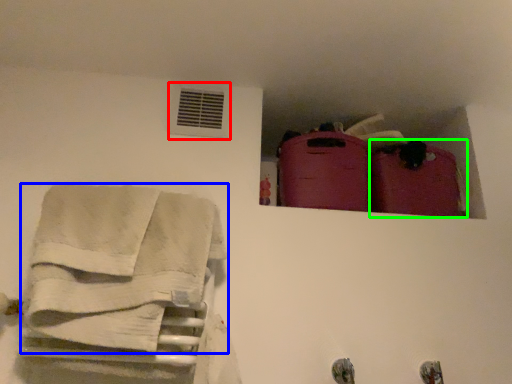
Question: Which object is positioned farthest from air conditioning (highlighted by a red box)? Select from towel (highlighted by a blue box) and luggage (highlighted by a green box).

Choices:
 (A) towel
 (B) luggage

Answer: (B)